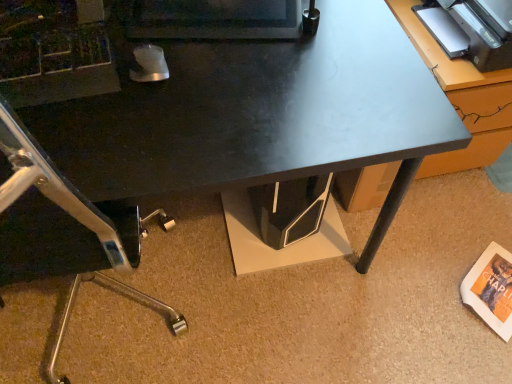
Question: Can black glossy desk at center be found inside matte black monitor at upper center?

Choices:
 (A) yes
 (B) no

Answer: (B)

Question: Is matte black monitor at upper center to the right of black glossy desk at center from the viewer's perspective?

Choices:
 (A) no
 (B) yes

Answer: (B)

Question: Is matte black monitor at upper center smaller than black glossy desk at center?

Choices:
 (A) no
 (B) yes

Answer: (B)

Question: Considering the relative positions of matte black monitor at upper center and black glossy desk at center in the image provided, is matte black monitor at upper center in front of black glossy desk at center?

Choices:
 (A) yes
 (B) no

Answer: (B)

Question: From a real-world perspective, is matte black monitor at upper center on top of black glossy desk at center?

Choices:
 (A) yes
 (B) no

Answer: (A)

Question: Is metallic gray table at upper right inside or outside of matte black monitor at upper center?

Choices:
 (A) inside
 (B) outside

Answer: (B)

Question: Is metallic gray table at upper right bigger or smaller than matte black monitor at upper center?

Choices:
 (A) small
 (B) big

Answer: (B)

Question: From a real-world perspective, relative to matte black monitor at upper center, is metallic gray table at upper right vertically above or below?

Choices:
 (A) above
 (B) below

Answer: (B)

Question: From the image's perspective, is metallic gray table at upper right positioned above or below matte black monitor at upper center?

Choices:
 (A) below
 (B) above

Answer: (A)

Question: In terms of height, does black glossy desk at center look taller or shorter compared to matte black monitor at upper center?

Choices:
 (A) tall
 (B) short

Answer: (A)

Question: From the image's perspective, is black glossy desk at center positioned above or below matte black monitor at upper center?

Choices:
 (A) below
 (B) above

Answer: (A)

Question: Is black glossy desk at center in front of or behind matte black monitor at upper center in the image?

Choices:
 (A) behind
 (B) front

Answer: (B)

Question: Based on their sizes in the image, would you say black glossy desk at center is bigger or smaller than matte black monitor at upper center?

Choices:
 (A) small
 (B) big

Answer: (B)

Question: Would you say matte black monitor at upper center is to the left or to the right of metallic gray table at upper right in the picture?

Choices:
 (A) left
 (B) right

Answer: (A)

Question: From their relative heights in the image, would you say matte black monitor at upper center is taller or shorter than metallic gray table at upper right?

Choices:
 (A) tall
 (B) short

Answer: (B)